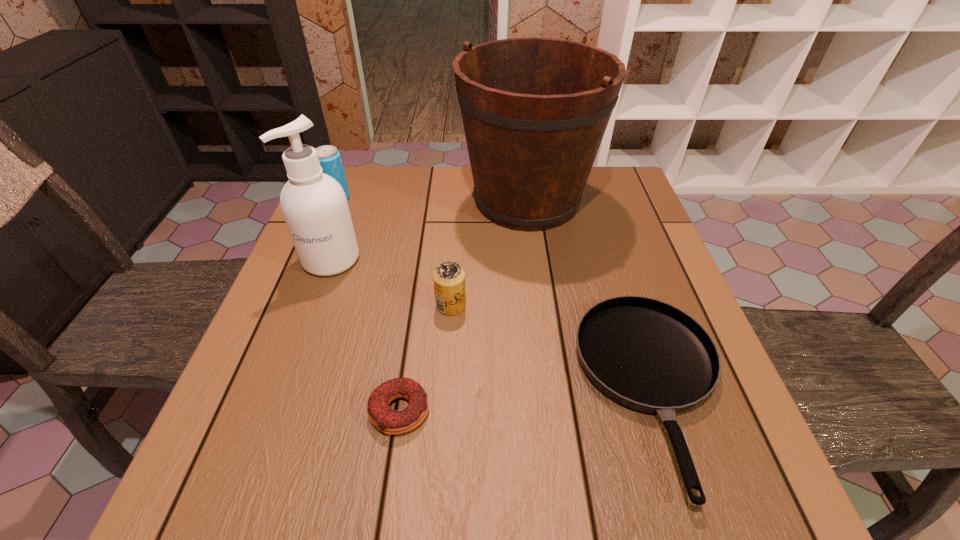
Locate an element on the screen. This screenshot has height=540, width=960. bucket is located at coordinates (535, 110).

You are a GUI agent. You are given a task and a screenshot of the screen. Output one action in this format:
    pyautogui.click(x=<x>, y=<y>)
    Task: Click on the cleansing agent
    The width and height of the screenshot is (960, 540).
    Given the screenshot: What is the action you would take?
    pyautogui.click(x=314, y=206)

The image size is (960, 540). Identify the location of the fourth shortest object. (329, 157).

You are a GUI agent. You are given a task and a screenshot of the screen. Output one action in this format:
    pyautogui.click(x=<x>, y=<y>)
    Task: Click on the beer can
    The image size is (960, 540).
    Given the screenshot: What is the action you would take?
    pyautogui.click(x=449, y=278)

This screenshot has width=960, height=540. Identify the location of doughnut. (388, 421).

You are a GUI agent. You are given a task and a screenshot of the screen. Output one action in this format:
    pyautogui.click(x=<x>, y=<y>)
    Task: Click on the frying pan
    
    Given the screenshot: What is the action you would take?
    pyautogui.click(x=648, y=355)

Image resolution: width=960 pixels, height=540 pixels. Find the location of `vacant region located 0.300m on the left of the bucket`. vacant region located 0.300m on the left of the bucket is located at coordinates (348, 201).

Where is `vacant space situated 0.280m on the front label of the cleansing agent`? The height and width of the screenshot is (540, 960). vacant space situated 0.280m on the front label of the cleansing agent is located at coordinates (284, 388).

Locate an element on the screen. The height and width of the screenshot is (540, 960). free space located on the front of the soda can is located at coordinates (312, 259).

This screenshot has width=960, height=540. Find the location of `vacant space situated on the back of the third shortest object`. vacant space situated on the back of the third shortest object is located at coordinates (455, 242).